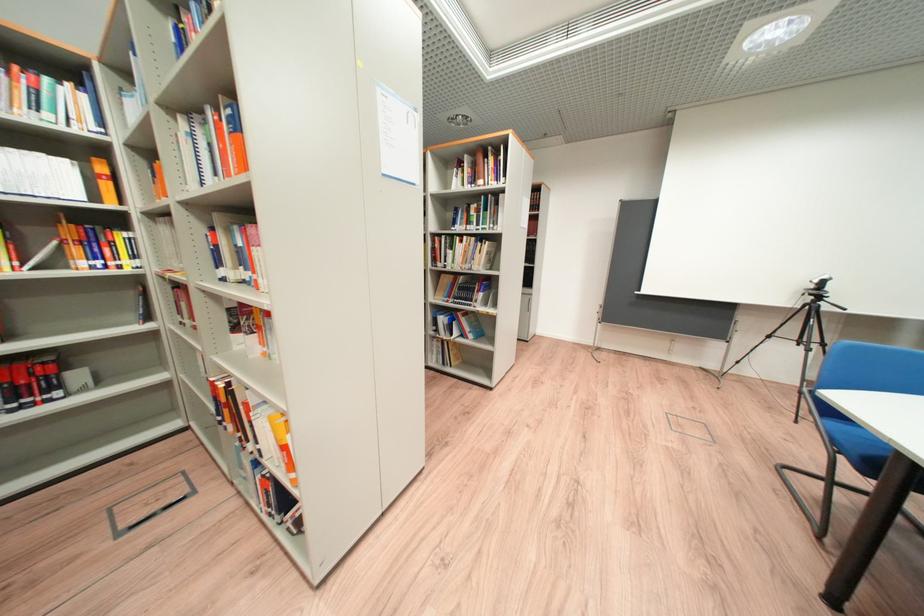
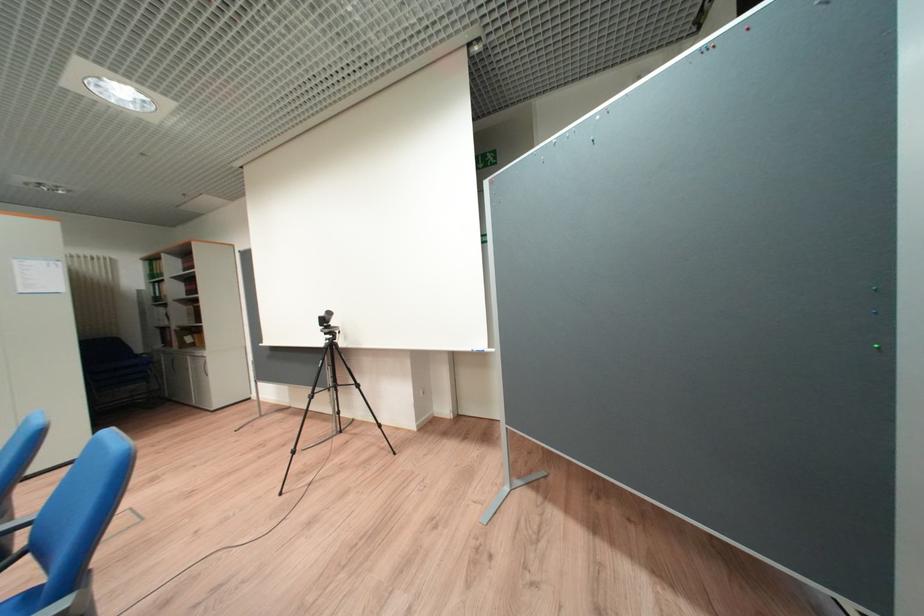
Question: The images are taken continuously from a first-person perspective. In which direction are you moving?

Choices:
 (A) Left
 (B) Right
 (C) Forward
 (D) Backward

Answer: (B)